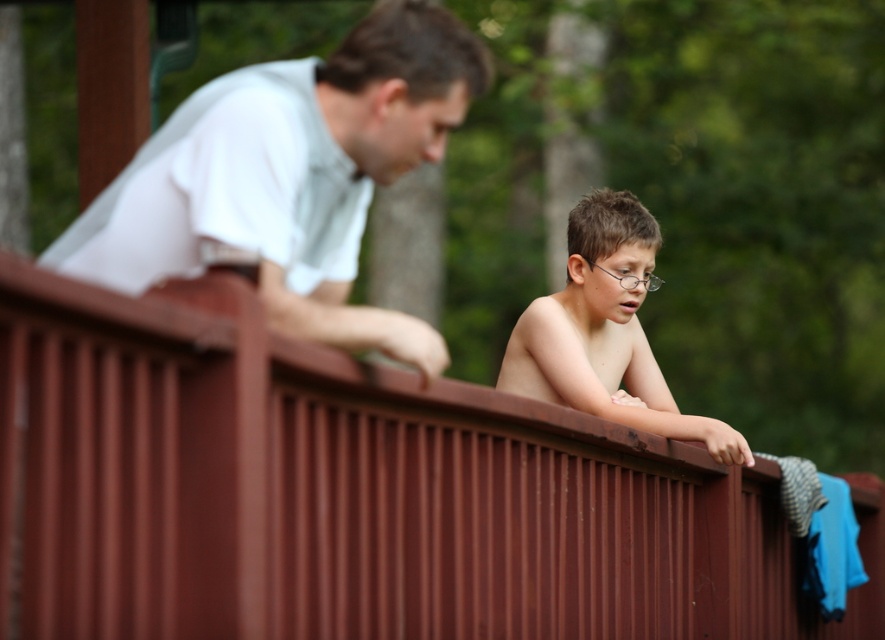
You are a photographer trying to capture the best shot of the scene. The white matte shirt at upper left and the shiny brown hair at center are both in focus. Which object should you adjust your camera focus to if you want to prioritize the taller one?

The shiny brown hair at center is taller than the white matte shirt at upper left, so you should adjust the camera focus to prioritize the shiny brown hair at center.